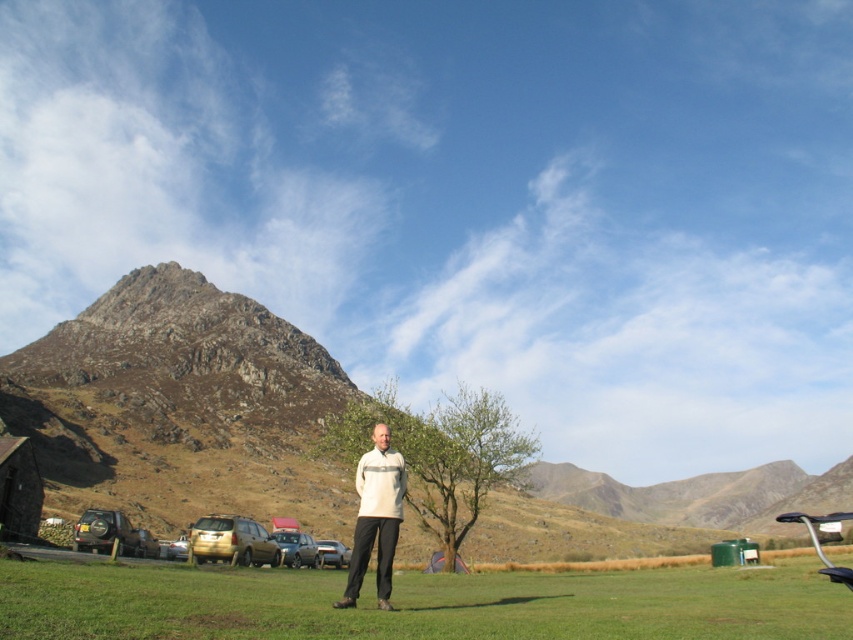
Does metallic silver car at center have a lesser height compared to metallic silver car at lower center?

Correct, metallic silver car at center is not as tall as metallic silver car at lower center.

The image size is (853, 640). What do you see at coordinates (296, 548) in the screenshot?
I see `metallic silver car at center` at bounding box center [296, 548].

Is point (285, 563) farther from camera compared to point (334, 545)?

No, it is in front of (334, 545).

Identify the location of metallic silver car at center. (296, 548).

Measure the distance between light beige sweater at center and metallic gold suv at lower left.

light beige sweater at center is 21.61 meters from metallic gold suv at lower left.

Who is taller, light beige sweater at center or metallic gold suv at lower left?

light beige sweater at center is taller.

Is point (376, 568) less distant than point (96, 524)?

Yes.

This screenshot has height=640, width=853. I want to click on light beige sweater at center, so click(376, 516).

Between rugged stone mountain at center and metallic gold suv at lower left, which one appears on the left side from the viewer's perspective?

From the viewer's perspective, metallic gold suv at lower left appears more on the left side.

Is rugged stone mountain at center above metallic gold suv at lower left?

No, rugged stone mountain at center is not above metallic gold suv at lower left.

Between point (701, 544) and point (123, 525), which one is positioned behind?

The point (701, 544) is behind.

The image size is (853, 640). In order to click on rugged stone mountain at center in this screenshot , I will do `click(180, 406)`.